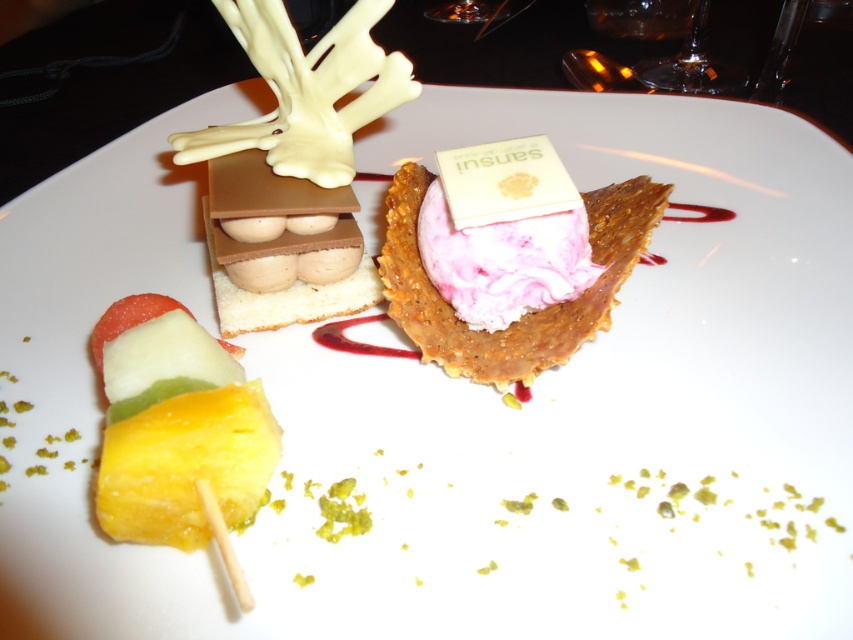
Question: Which of the following is the closest to the observer?

Choices:
 (A) (401, 198)
 (B) (103, 529)

Answer: (B)

Question: Which object is closer to the camera taking this photo?

Choices:
 (A) pink creamy ice cream at center
 (B) multicolored fruit skewer at center

Answer: (B)

Question: Can you confirm if multicolored fruit skewer at center is thinner than pink creamy ice cream at center?

Choices:
 (A) yes
 (B) no

Answer: (A)

Question: Can you confirm if multicolored fruit skewer at center is positioned to the right of pink creamy ice cream at center?

Choices:
 (A) yes
 (B) no

Answer: (B)

Question: Can you confirm if multicolored fruit skewer at center is positioned below pink creamy ice cream at center?

Choices:
 (A) no
 (B) yes

Answer: (B)